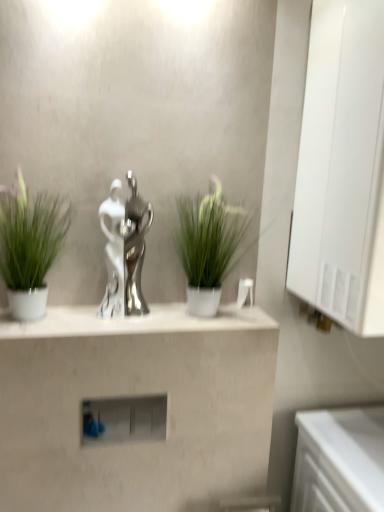
Locate an element on the screen. The height and width of the screenshot is (512, 384). free area in between silver metallic trophy at center and green matte plant at center, the first houseplant when ordered from right to left is located at coordinates (153, 314).